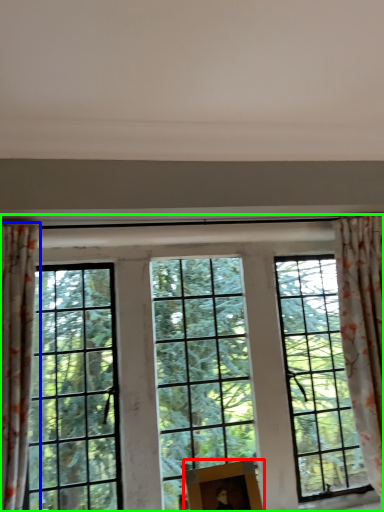
Question: Which object is positioned farthest from picture frame (highlighted by a red box)? Select from curtain (highlighted by a blue box) and window (highlighted by a green box).

Choices:
 (A) curtain
 (B) window

Answer: (A)